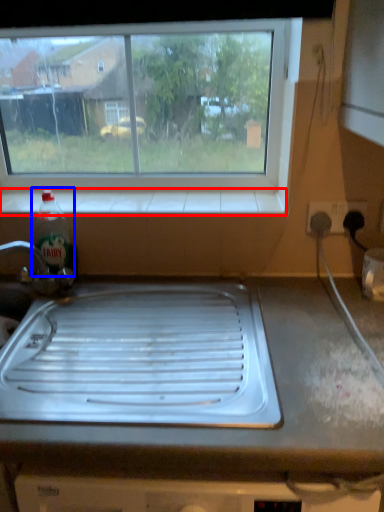
Question: Which point is closer to the camera, window sill (highlighted by a red box) or bottle (highlighted by a blue box)?

Choices:
 (A) window sill
 (B) bottle

Answer: (B)